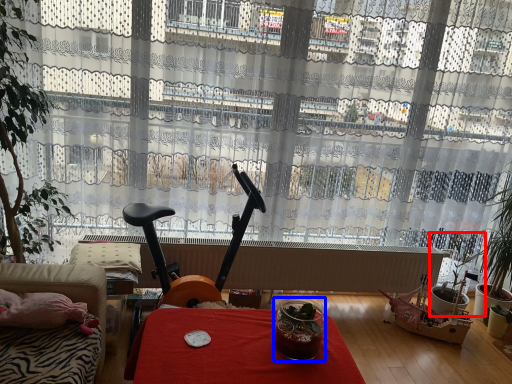
Question: Which point is further to the camera, houseplant (highlighted by a red box) or glass jar (highlighted by a blue box)?

Choices:
 (A) houseplant
 (B) glass jar

Answer: (A)